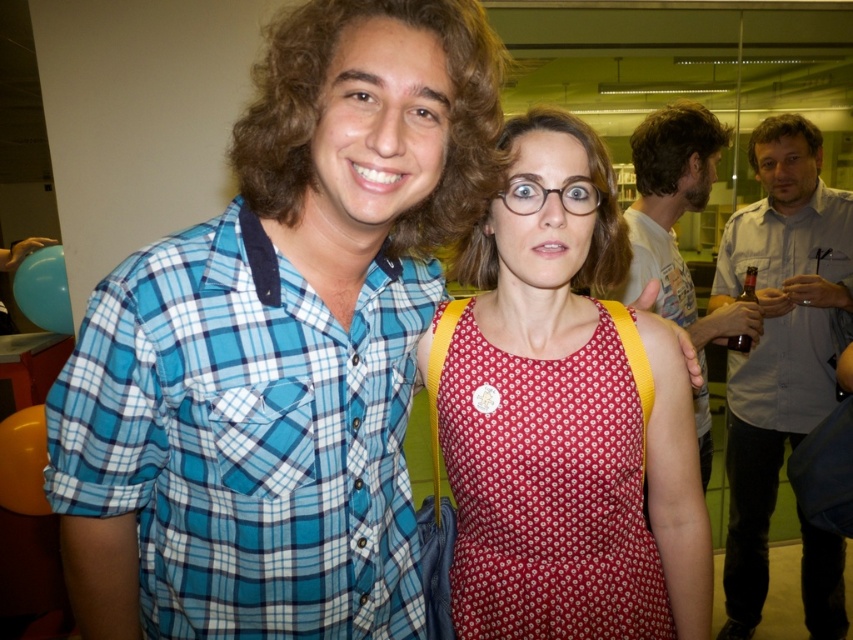
Where is `light blue plaid shirt at upper right`? This screenshot has width=853, height=640. light blue plaid shirt at upper right is located at coordinates (785, 372).

Does dotted fabric dress at center lie behind matte white shirt at center?

No.

Locate an element on the screen. dotted fabric dress at center is located at coordinates (540, 488).

Can you confirm if matte white shirt at center is positioned to the right of clear plastic glasses at center?

Correct, you'll find matte white shirt at center to the right of clear plastic glasses at center.

Who is more forward, (x=650, y=237) or (x=590, y=209)?

Positioned in front is point (x=590, y=209).

I want to click on matte white shirt at center, so click(x=674, y=237).